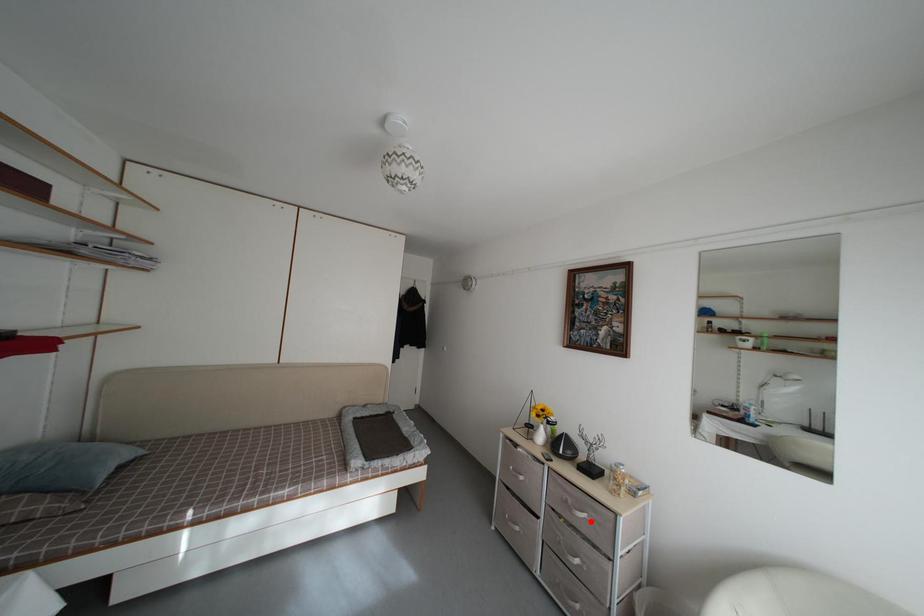
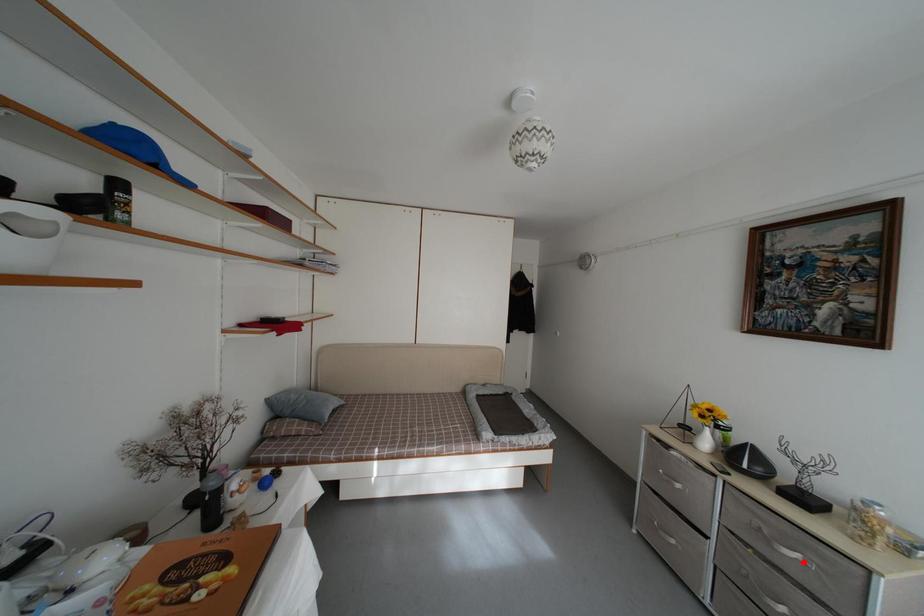
I am providing you with two images of the same scene from different viewpoints. A red point is marked on the first image and another point is marked on the second image. Is the red point in image1 aligned with the point shown in image2?

Yes